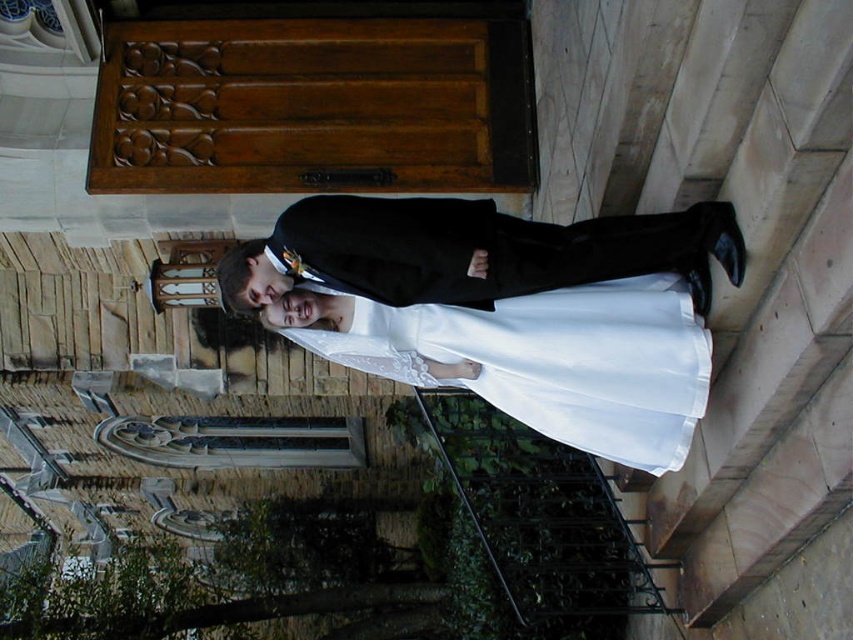
Question: Which point is farther from the camera taking this photo?

Choices:
 (A) (689, 417)
 (B) (711, 204)

Answer: (A)

Question: Is the position of satin white dress at center less distant than that of white satin dress at center?

Choices:
 (A) yes
 (B) no

Answer: (B)

Question: Can you confirm if satin white dress at center is positioned above white satin dress at center?

Choices:
 (A) no
 (B) yes

Answer: (A)

Question: Can you confirm if satin white dress at center is smaller than white satin dress at center?

Choices:
 (A) no
 (B) yes

Answer: (A)